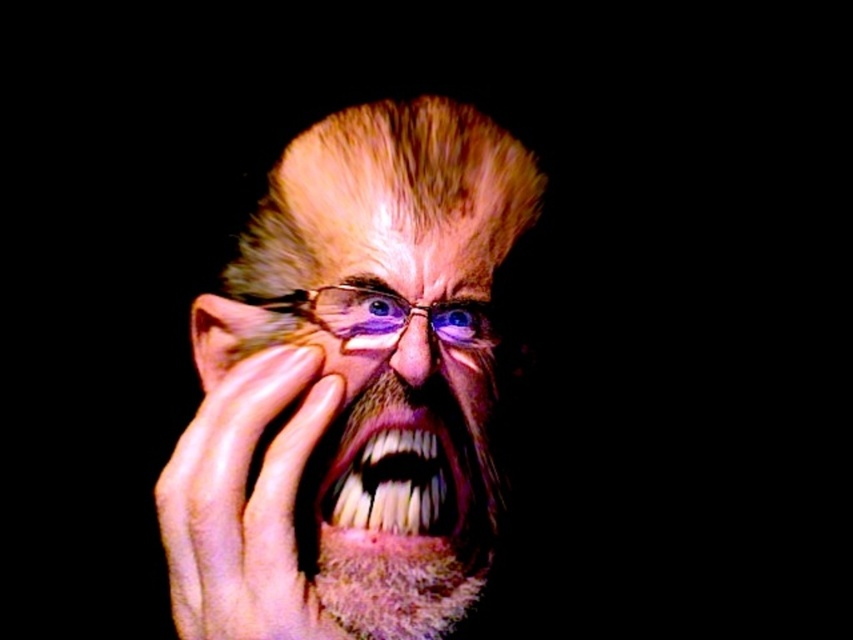
Question: Is smooth skin hand at center thinner than blue glossy eye at center?

Choices:
 (A) no
 (B) yes

Answer: (A)

Question: Which of the following is the closest to the observer?

Choices:
 (A) (428, 310)
 (B) (207, 525)
 (C) (451, 444)

Answer: (B)

Question: Does blue glossy eye at center appear on the left side of blue glassy eye at center?

Choices:
 (A) yes
 (B) no

Answer: (B)

Question: Can you confirm if smooth skin hand at center is smaller than blue glassy eye at center?

Choices:
 (A) yes
 (B) no

Answer: (B)

Question: Which point is closer to the camera?

Choices:
 (A) (418, 154)
 (B) (323, 515)
 (C) (344, 612)
 (D) (230, 516)

Answer: (D)

Question: Which point appears closest to the camera in this image?

Choices:
 (A) (397, 467)
 (B) (467, 321)

Answer: (A)